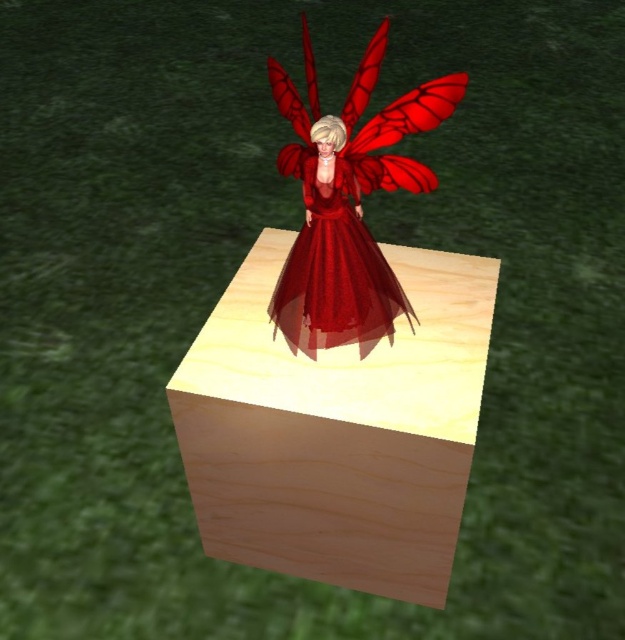
Does wooden cube at center have a larger size compared to shiny red dress at center?

Yes, wooden cube at center is bigger than shiny red dress at center.

Is wooden cube at center to the left of shiny red dress at center from the viewer's perspective?

Correct, you'll find wooden cube at center to the left of shiny red dress at center.

Between point (445, 444) and point (360, 147), which one is positioned behind?

The point (445, 444) is more distant.

This screenshot has width=625, height=640. I want to click on wooden cube at center, so pyautogui.click(x=338, y=429).